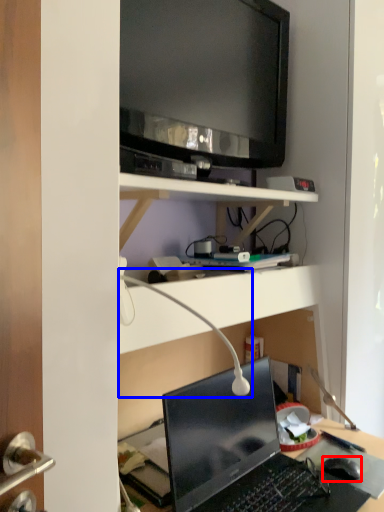
Question: Which of the following is the closest to the observer, computer mouse (highlighted by a red box) or table lamp (highlighted by a blue box)?

Choices:
 (A) computer mouse
 (B) table lamp

Answer: (B)